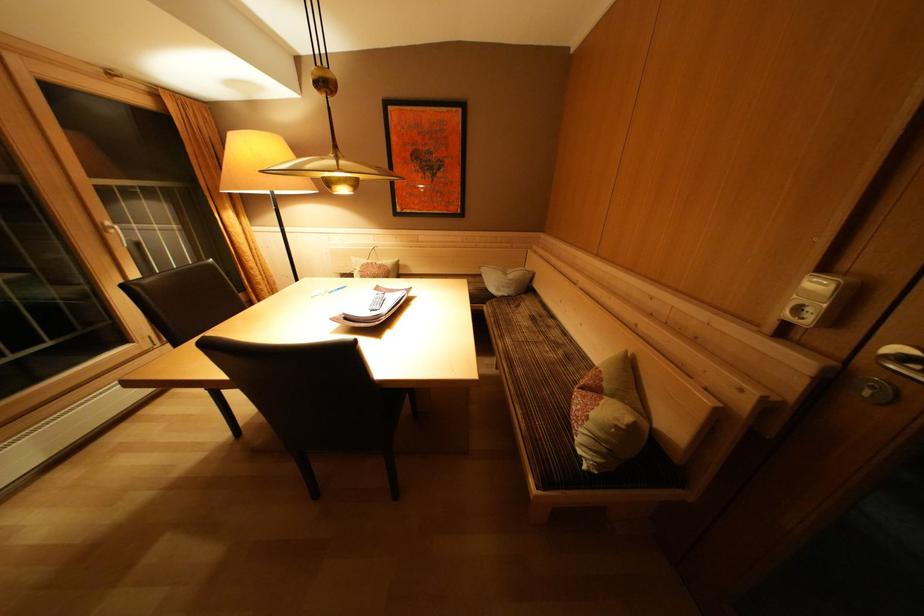
Locate an element on the screen. This screenshot has height=616, width=924. sofa sitting surface is located at coordinates (533, 355).